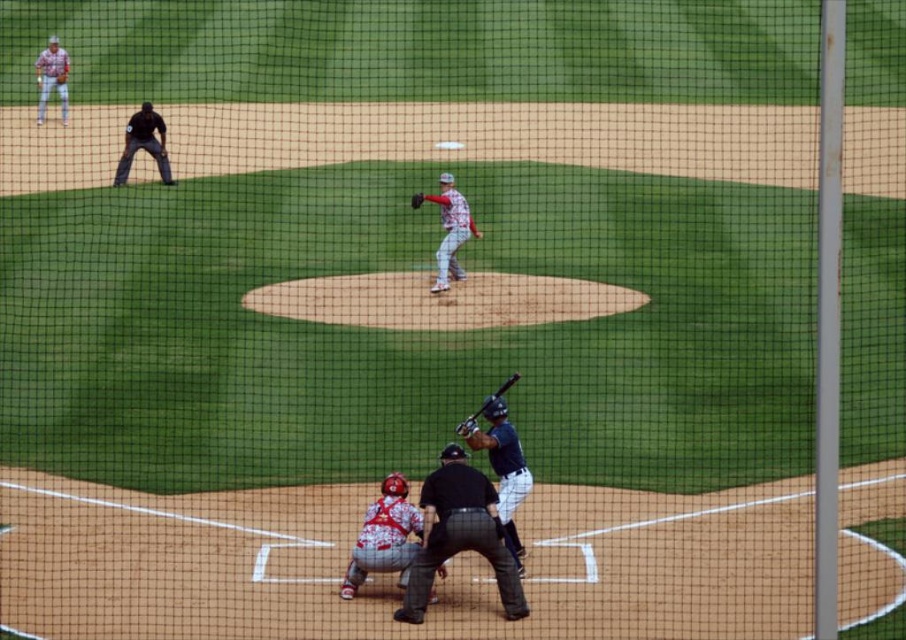
You are a photographer standing at the edge of the field and want to take a photo that includes both point (x=60, y=52) and point (x=502, y=385). Since you can only focus on one point clearly, which point should you focus on to ensure the other point is still in the background?

You should focus on point (x=60, y=52) because it is closer to you than point (x=502, y=385), so the latter will naturally be in the background.

You are a spectator at the baseball game and want to know if the black leather umpire at center can see over the dark blue uniform at center. Based on their heights, what do you think?

The black leather umpire at center has a lesser height compared to dark blue uniform at center, so the umpire might not be able to see over the dark blue uniform at center due to the height difference.

You are a coach standing at the dugout and want to place two markers on the field. The first marker should be placed at point (54, 74) and the second at point (410, 202). Which marker will be closer to the batter?

Point (54, 74) is behind point (410, 202), so the marker at point (410, 202) will be closer to the batter.